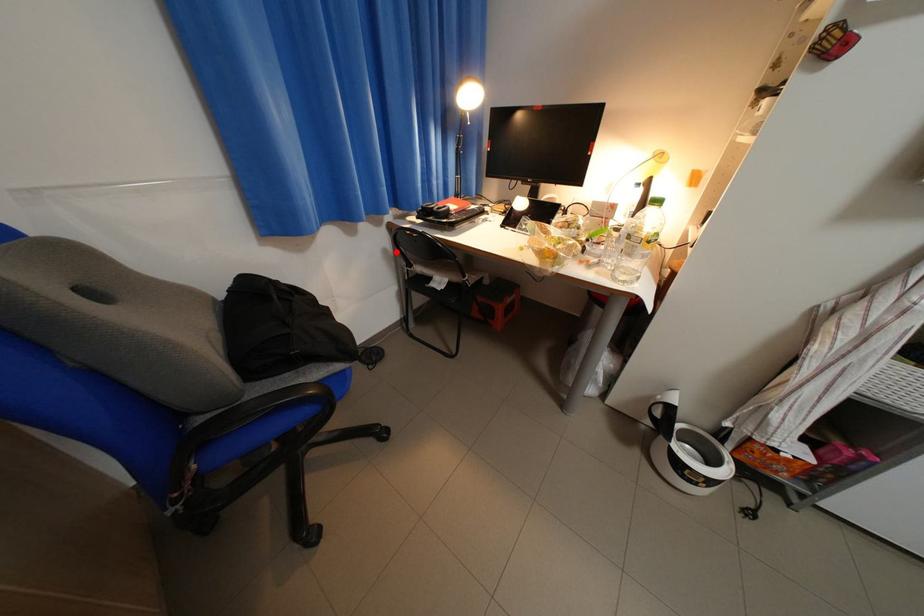
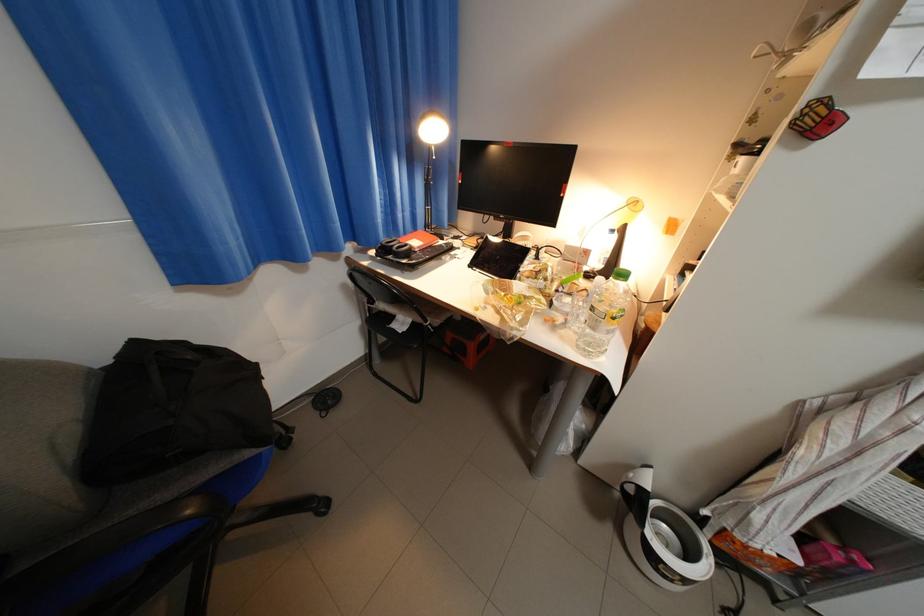
Locate, in the second image, the point that corresponds to the highlighted location in the first image.

(355, 286)